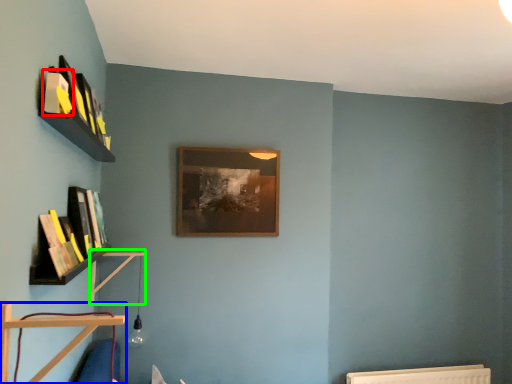
Question: Which object is positioned closest to book (highlighted by a red box)? Select from shelf (highlighted by a blue box) and shelf (highlighted by a green box).

Choices:
 (A) shelf
 (B) shelf

Answer: (A)